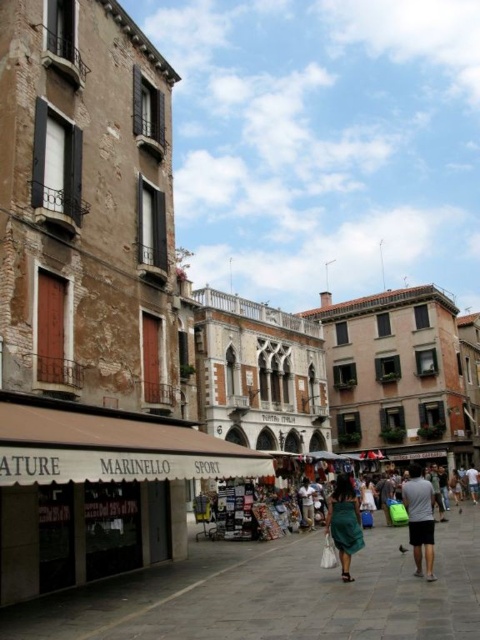
Does gray cotton shirt at center have a smaller size compared to green fabric dress at center?

No, gray cotton shirt at center is not smaller than green fabric dress at center.

The height and width of the screenshot is (640, 480). I want to click on gray cotton shirt at center, so click(x=420, y=518).

I want to click on gray cotton shirt at center, so click(420, 518).

This screenshot has width=480, height=640. Describe the element at coordinates (420, 518) in the screenshot. I see `gray cotton shirt at center` at that location.

Is gray cotton shirt at center to the left of green fabric skirt at center from the viewer's perspective?

Incorrect, gray cotton shirt at center is not on the left side of green fabric skirt at center.

At what (x,y) coordinates should I click in order to perform the action: click on gray cotton shirt at center. Please return your answer as a coordinate pair (x, y). Looking at the image, I should click on (420, 518).

Can you confirm if green fabric skirt at center is positioned to the left of green fabric dress at center?

No, green fabric skirt at center is not to the left of green fabric dress at center.

Measure the distance between green fabric skirt at center and green fabric dress at center.

The distance of green fabric skirt at center from green fabric dress at center is 24.10 feet.

Which is behind, point (350, 518) or point (303, 499)?

Positioned behind is point (303, 499).

The image size is (480, 640). Identify the location of green fabric skirt at center. (345, 522).